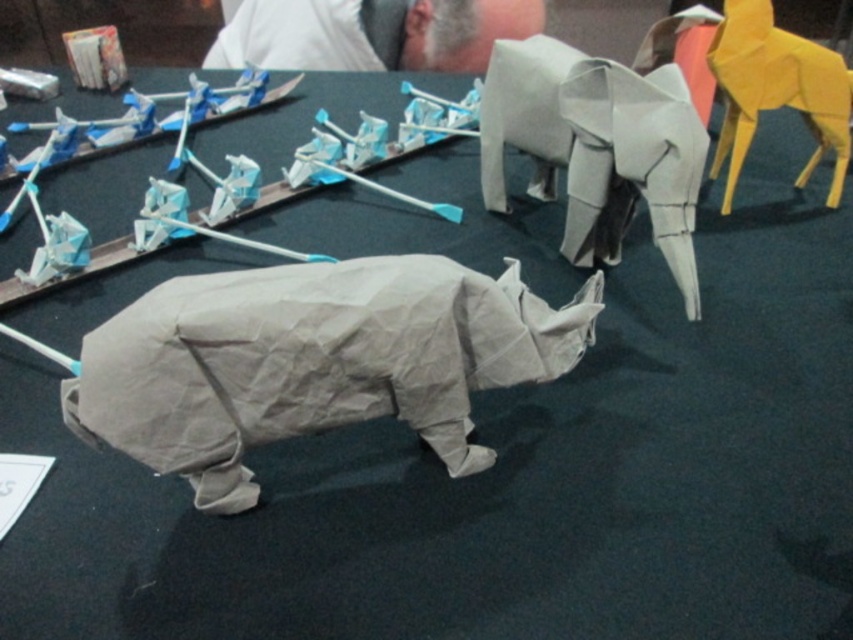
You are an art curator arranging an exhibition. You have a gray paper rhino at center and a yellow paper giraffe at upper right. Which animal should you place closer to the entrance to ensure visitors can see both clearly?

The gray paper rhino at center is smaller than the yellow paper giraffe at upper right, so you should place the gray paper rhino at center closer to the entrance to ensure it is visible alongside the larger yellow paper giraffe at upper right.

You are an art curator examining the origami display. You need to determine the spatial arrangement for a catalog. Which object is positioned closer to the viewer between the gray paper rhino at center and the yellow paper giraffe at upper right?

The gray paper rhino at center is closer to the viewer than the yellow paper giraffe at upper right.